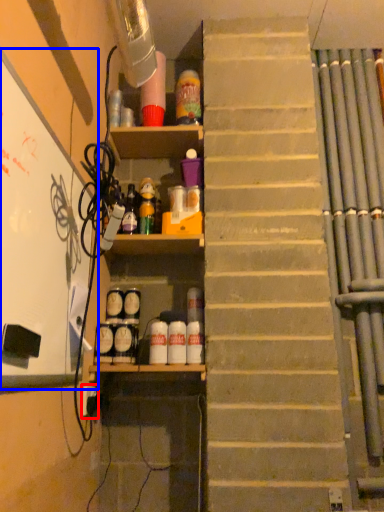
Question: Which of the following is the farthest to the observer, electric outlet (highlighted by a red box) or bulletin board (highlighted by a blue box)?

Choices:
 (A) electric outlet
 (B) bulletin board

Answer: (A)